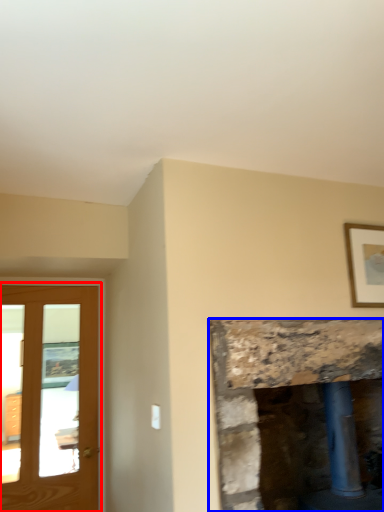
Question: Which point is closer to the camera, screen door (highlighted by a red box) or fireplace (highlighted by a blue box)?

Choices:
 (A) screen door
 (B) fireplace

Answer: (B)